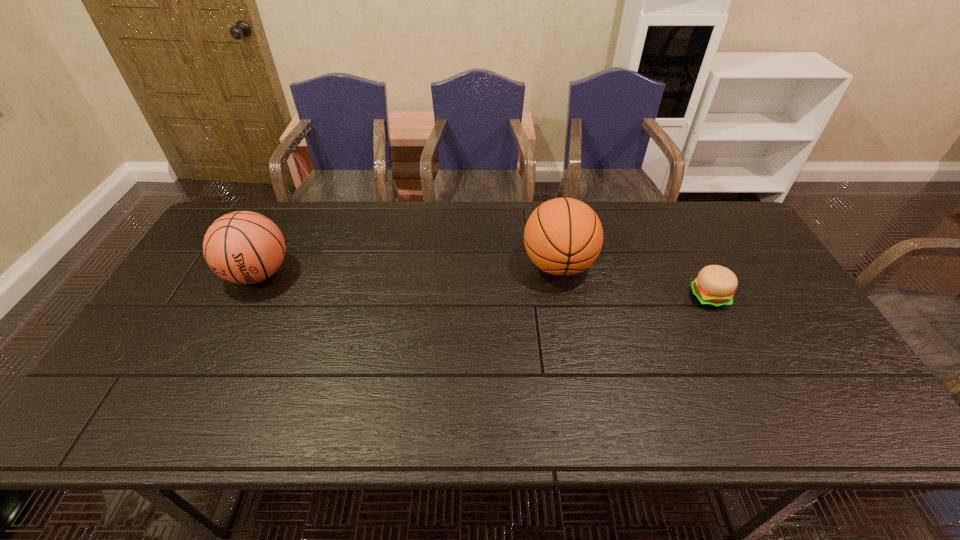
Where is `free space that is in between the leftmost object and the shortest object`? free space that is in between the leftmost object and the shortest object is located at coordinates (484, 285).

Locate an element on the screen. This screenshot has height=540, width=960. unoccupied area between the hamburger and the right basketball is located at coordinates (634, 281).

Where is `blank region between the second object from right to left and the shortest object`? The image size is (960, 540). blank region between the second object from right to left and the shortest object is located at coordinates (634, 281).

You are a GUI agent. You are given a task and a screenshot of the screen. Output one action in this format:
    pyautogui.click(x=<x>, y=<y>)
    Task: Click on the unoccupied position between the second object from right to left and the left basketball
    This screenshot has height=540, width=960.
    Given the screenshot: What is the action you would take?
    pyautogui.click(x=408, y=269)

Find the location of a particular element. vacant area between the leftmost object and the shortest object is located at coordinates (484, 285).

Locate an element on the screen. The width and height of the screenshot is (960, 540). the closest object relative to the right basketball is located at coordinates (714, 287).

Identify which object is the closest to the rightmost object. Please provide its 2D coordinates. Your answer should be formatted as a tuple, i.e. [(x, y)], where the tuple contains the x and y coordinates of a point satisfying the conditions above.

[(563, 236)]

Find the location of a particular element. The width and height of the screenshot is (960, 540). vacant region that satisfies the following two spatial constraints: 1. on the surface of the leftmost object near the brand logo; 2. on the right side of the rightmost object is located at coordinates (247, 297).

The width and height of the screenshot is (960, 540). Find the location of `vacant space that satisfies the following two spatial constraints: 1. on the front side of the hamburger; 2. on the right side of the right basketball`. vacant space that satisfies the following two spatial constraints: 1. on the front side of the hamburger; 2. on the right side of the right basketball is located at coordinates click(564, 297).

Where is `vacant region that satisfies the following two spatial constraints: 1. on the surface of the rightmost object near the brand logo; 2. on the left side of the left basketball`? vacant region that satisfies the following two spatial constraints: 1. on the surface of the rightmost object near the brand logo; 2. on the left side of the left basketball is located at coordinates (247, 297).